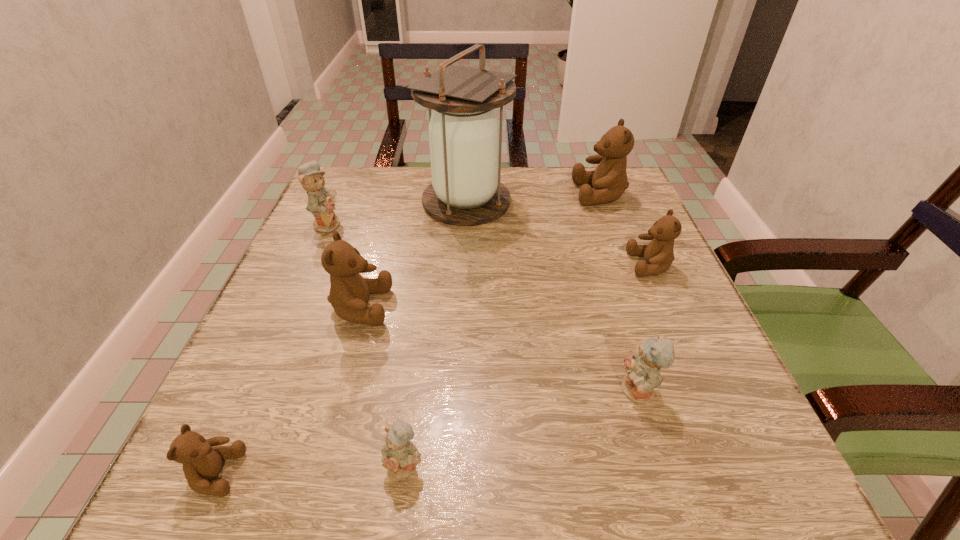
This screenshot has width=960, height=540. Find the location of `blank region between the second farthest brown teddy bear and the tallest teddy bear`. blank region between the second farthest brown teddy bear and the tallest teddy bear is located at coordinates (625, 230).

Find the location of a particular element. free spot between the leftmost blue teddy bear and the leftmost brown teddy bear is located at coordinates click(272, 348).

Identify the location of free spot between the sixth farthest object and the smallest brown teddy bear. This screenshot has height=540, width=960. (427, 433).

Find the location of a particular element. The image size is (960, 540). vacant area that lies between the leftmost brown teddy bear and the third teddy bear from left to right is located at coordinates (288, 390).

Find the location of `empty space that is in between the leftmost brown teddy bear and the nearest blue teddy bear`. empty space that is in between the leftmost brown teddy bear and the nearest blue teddy bear is located at coordinates click(310, 469).

The height and width of the screenshot is (540, 960). I want to click on empty space between the third farthest teddy bear and the tallest object, so click(559, 233).

Identify the location of vacant area between the leftmost brown teddy bear and the lantern. This screenshot has height=540, width=960. (341, 338).

Identify which object is located as the second nearest to the second blue teddy bear from left to right. Please provide its 2D coordinates. Your answer should be formatted as a tuple, i.e. [(x, y)], where the tuple contains the x and y coordinates of a point satisfying the conditions above.

[(349, 293)]

Choose which object is the fourth nearest neighbor to the farthest teddy bear. Please provide its 2D coordinates. Your answer should be formatted as a tuple, i.e. [(x, y)], where the tuple contains the x and y coordinates of a point satisfying the conditions above.

[(349, 293)]

Identify which teddy bear is the closest to the farthest brown teddy bear. Please provide its 2D coordinates. Your answer should be formatted as a tuple, i.e. [(x, y)], where the tuple contains the x and y coordinates of a point satisfying the conditions above.

[(659, 254)]